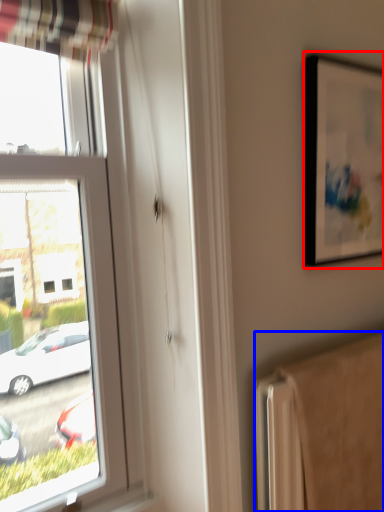
Question: Among these objects, which one is nearest to the camera, picture frame (highlighted by a red box) or radiator (highlighted by a blue box)?

Choices:
 (A) picture frame
 (B) radiator

Answer: (B)